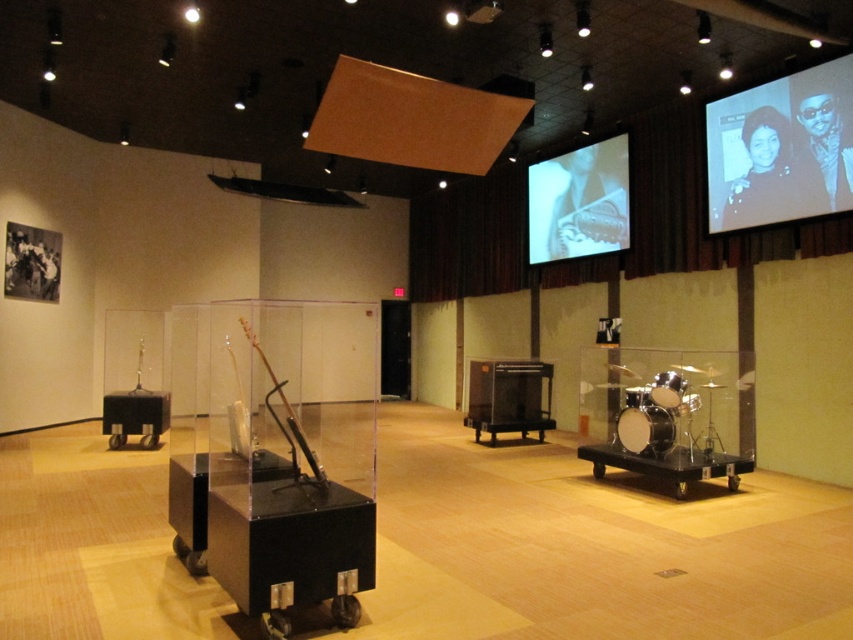
Which is behind, point (834, 154) or point (569, 198)?

The point (569, 198) is behind.

Which is in front, point (793, 150) or point (584, 220)?

Positioned in front is point (793, 150).

Does point (776, 221) lie in front of point (584, 252)?

Yes, point (776, 221) is closer to viewer.

This screenshot has height=640, width=853. I want to click on black glossy projection screen at upper right, so click(781, 148).